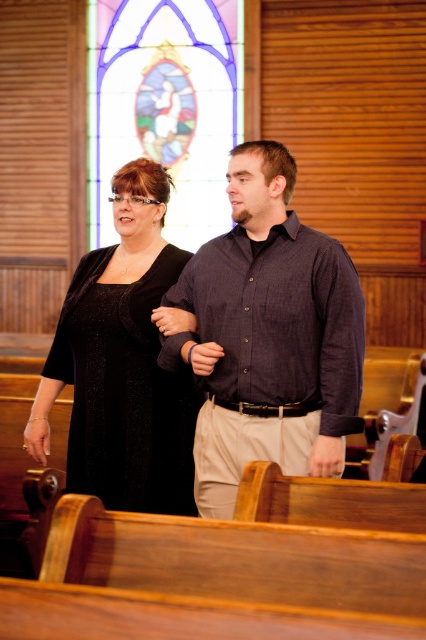
Question: Which point is closer to the camera taking this photo?

Choices:
 (A) (238, 58)
 (B) (351, 280)
 (C) (143, 387)

Answer: (B)

Question: Is stained glass window at upper center positioned at the back of black sparkly dress at center?

Choices:
 (A) yes
 (B) no

Answer: (A)

Question: Among these points, which one is farthest from the camera?

Choices:
 (A) (227, 324)
 (B) (219, 65)

Answer: (B)

Question: Is dark blue shirt at center smaller than stained glass window at upper center?

Choices:
 (A) yes
 (B) no

Answer: (A)

Question: Which object appears farthest from the camera in this image?

Choices:
 (A) black sparkly dress at center
 (B) dark blue shirt at center
 (C) stained glass window at upper center

Answer: (C)

Question: Observing the image, what is the correct spatial positioning of dark blue shirt at center in reference to black sparkly dress at center?

Choices:
 (A) right
 (B) left

Answer: (A)